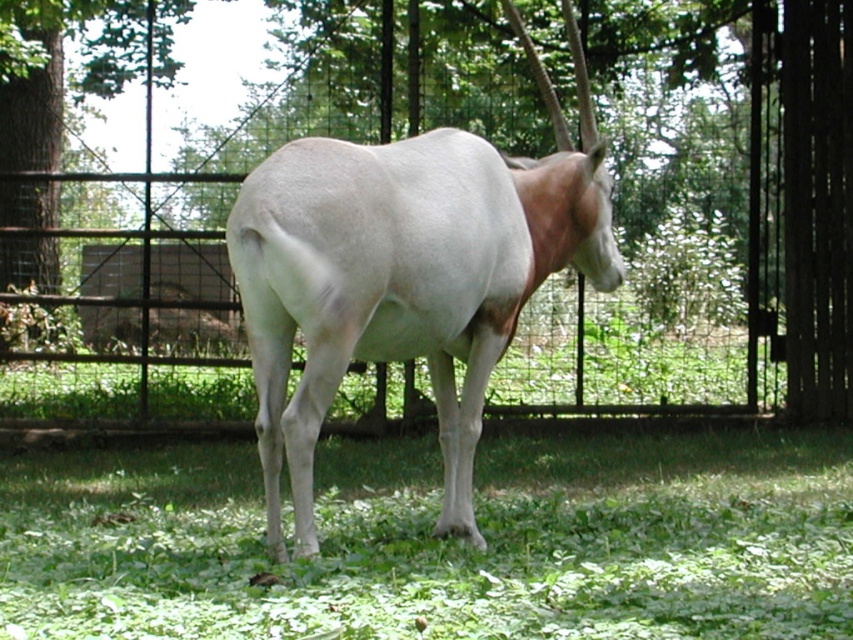
Question: Does metallic wire fence at center have a greater width compared to green leafy tree at center?

Choices:
 (A) yes
 (B) no

Answer: (B)

Question: Does metallic wire fence at center appear on the right side of white smooth antelope at center?

Choices:
 (A) no
 (B) yes

Answer: (A)

Question: Based on their relative distances, which object is nearer to the green leafy grass at lower center?

Choices:
 (A) green leafy tree at center
 (B) metallic wire fence at center
 (C) white smooth antelope at center

Answer: (C)

Question: Is metallic wire fence at center bigger than green leafy grass at lower center?

Choices:
 (A) yes
 (B) no

Answer: (B)

Question: Which of these objects is positioned farthest from the white smooth tail at center?

Choices:
 (A) green leafy tree at center
 (B) metallic wire fence at center
 (C) green leafy grass at lower center
 (D) white smooth antelope at center

Answer: (A)

Question: Which of the following is the closest to the observer?

Choices:
 (A) metallic wire fence at center
 (B) green leafy tree at center
 (C) white smooth tail at center

Answer: (C)